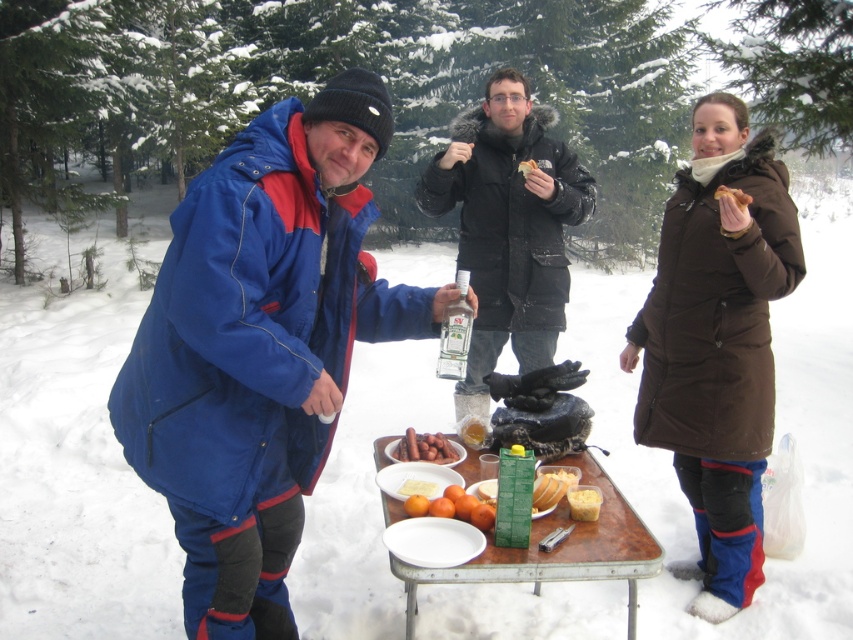
You are a guest at this snowy gathering and want to place a small gift on the table. The gift is slightly bigger than the yellow sponge cake at center. Will it fit on the wooden table at center?

The wooden table at center is larger in size than the yellow sponge cake at center, so the gift, being slightly bigger than the cake, should fit on the table.

You are a photographer trying to capture a photo of the two points mentioned in the scene. Which point, point [497,326] or point [523,177], is closer to your camera?

Point [523,177] is closer to the camera because it is less further than point [497,326].